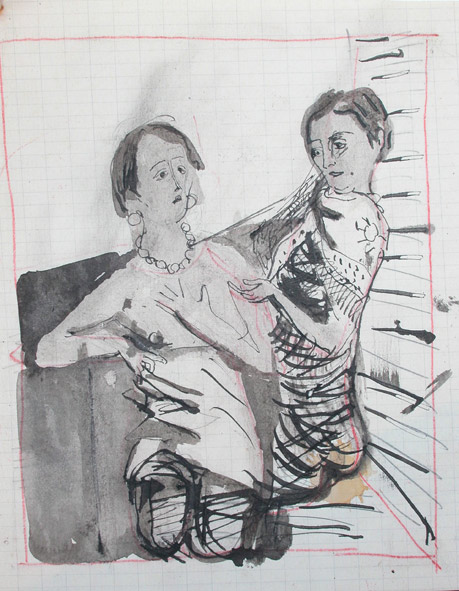
Find the location of a particular element. The image size is (459, 591). horizontal lines of a door or window from floor up is located at coordinates (412, 304).